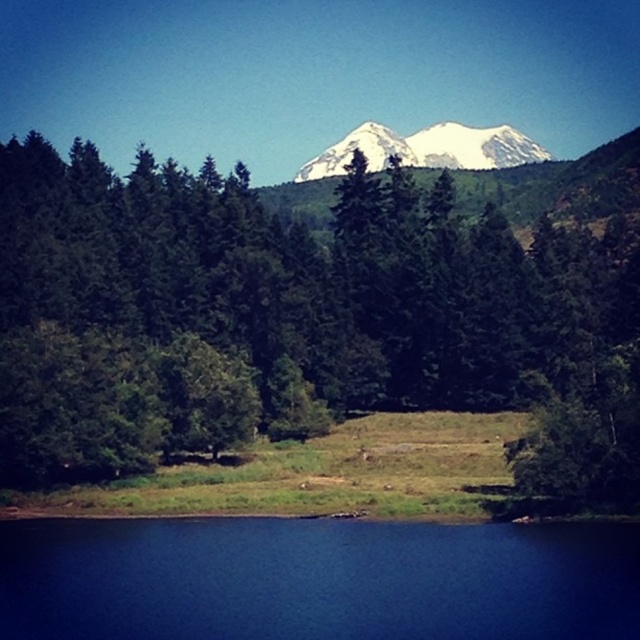
Question: Does green matte tree at center have a smaller size compared to blue liquid at lower center?

Choices:
 (A) yes
 (B) no

Answer: (B)

Question: Does green matte tree at center appear under blue liquid at lower center?

Choices:
 (A) no
 (B) yes

Answer: (A)

Question: Is green matte tree at center to the right of snowy white mountain at upper center from the viewer's perspective?

Choices:
 (A) yes
 (B) no

Answer: (B)

Question: Which of the following is the farthest from the observer?

Choices:
 (A) blue liquid at lower center
 (B) green matte tree at center
 (C) snowy white mountain at upper center

Answer: (C)

Question: Which object appears farthest from the camera in this image?

Choices:
 (A) green matte tree at center
 (B) snowy white mountain at upper center

Answer: (B)

Question: Which of the following is the farthest from the observer?

Choices:
 (A) green matte tree at center
 (B) snowy white mountain at upper center
 (C) blue liquid at lower center

Answer: (B)